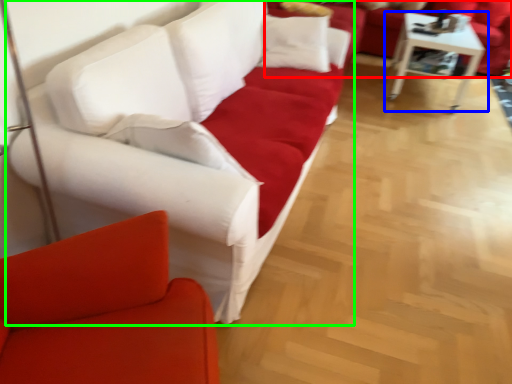
Question: Estimate the real-world distances between objects in this image. Which object is closer to studio couch (highlighted by a red box), table (highlighted by a blue box) or studio couch (highlighted by a green box)?

Choices:
 (A) table
 (B) studio couch

Answer: (A)